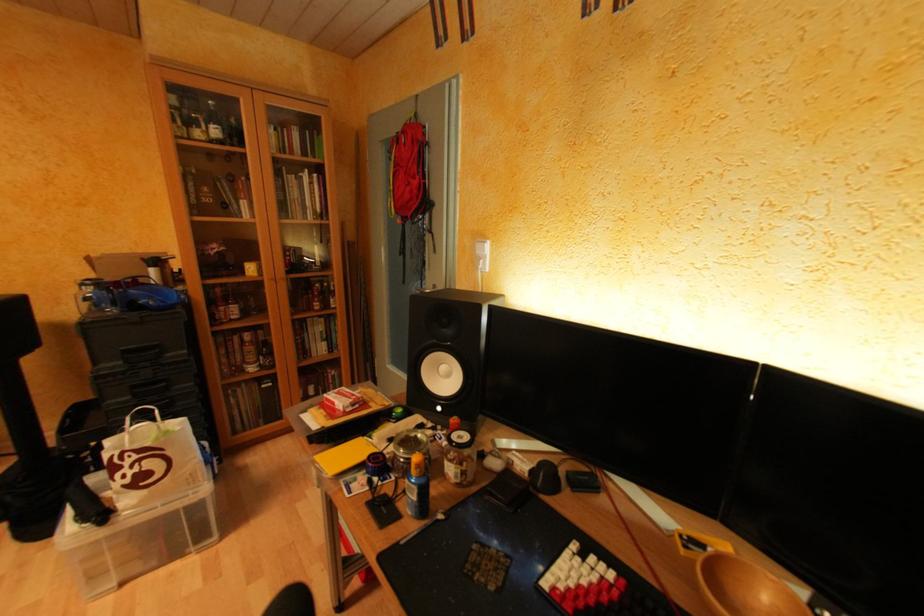
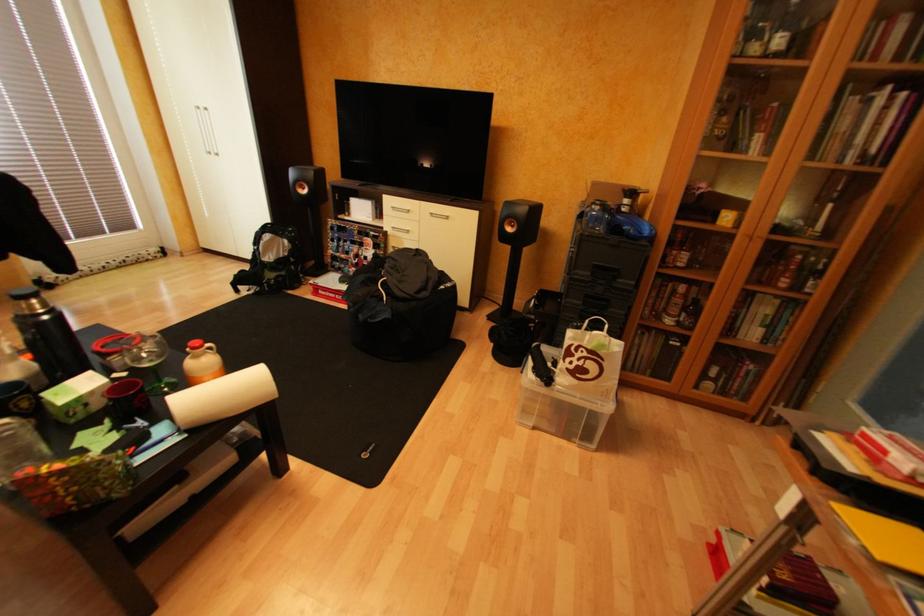
The first image is from the beginning of the video and the second image is from the end. How did the camera likely rotate when shooting the video?

The camera rotated toward left-down.